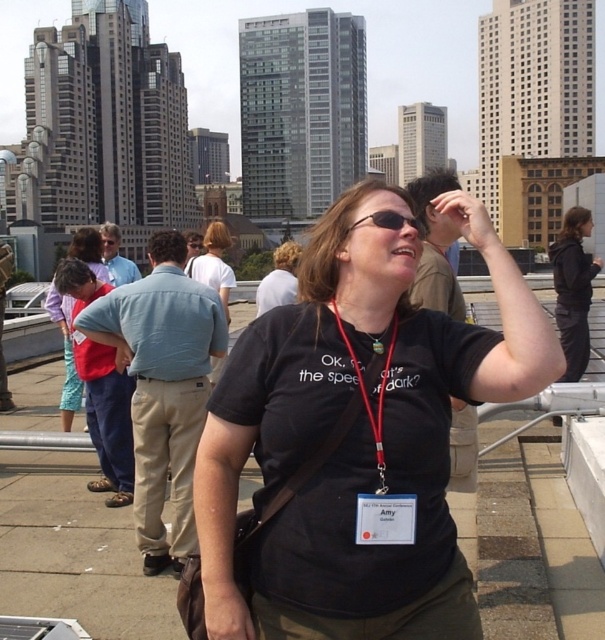
You are standing at the rooftop and see two points in the scene. The first point is labeled as point (574, 305) and the second is point (215, 221). From your perspective, which point is closer to you?

Point (574, 305) is in front of point (215, 221), so it is closer to you.

You are an event photographer at the rooftop gathering. You need to capture a photo that includes both the dark gray hoodie at upper right and the matte red shirt at left. Considering their sizes, which one should you focus on to ensure both fit in the frame without cropping?

The dark gray hoodie at upper right is narrower than the matte red shirt at left. To ensure both fit in the frame, focus on the wider matte red shirt at left to accommodate the smaller dark gray hoodie at upper right.

You are standing at the rooftop and see the point at coordinates (574, 289). What object is located at that point?

The point at coordinates (574, 289) corresponds to the dark gray hoodie at upper right.